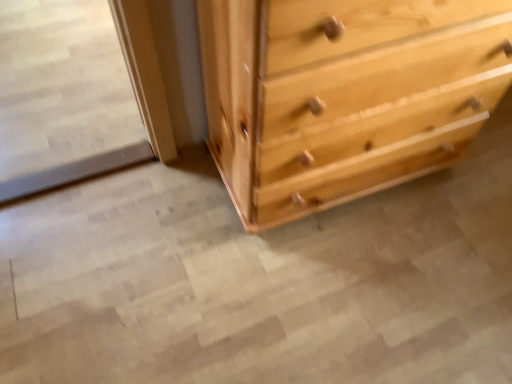
This screenshot has height=384, width=512. Find the location of `vacant area that is in front of natural wood chest of drawers at center`. vacant area that is in front of natural wood chest of drawers at center is located at coordinates (337, 292).